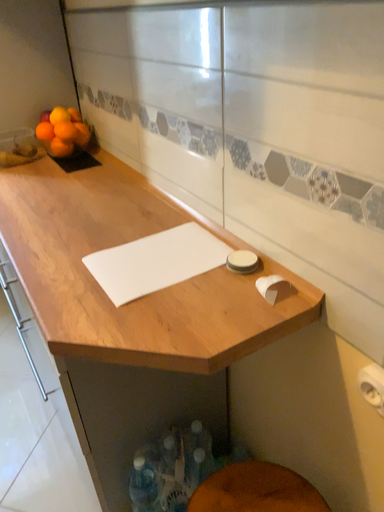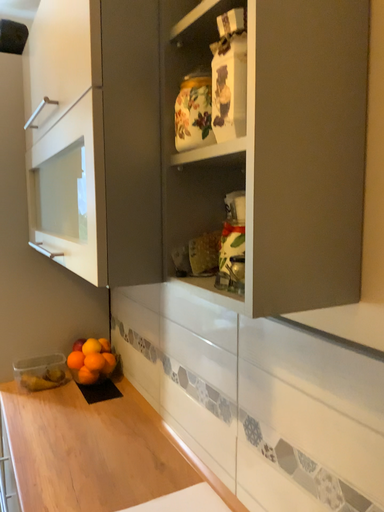
Question: How did the camera likely rotate when shooting the video?

Choices:
 (A) rotated upward
 (B) rotated downward

Answer: (A)